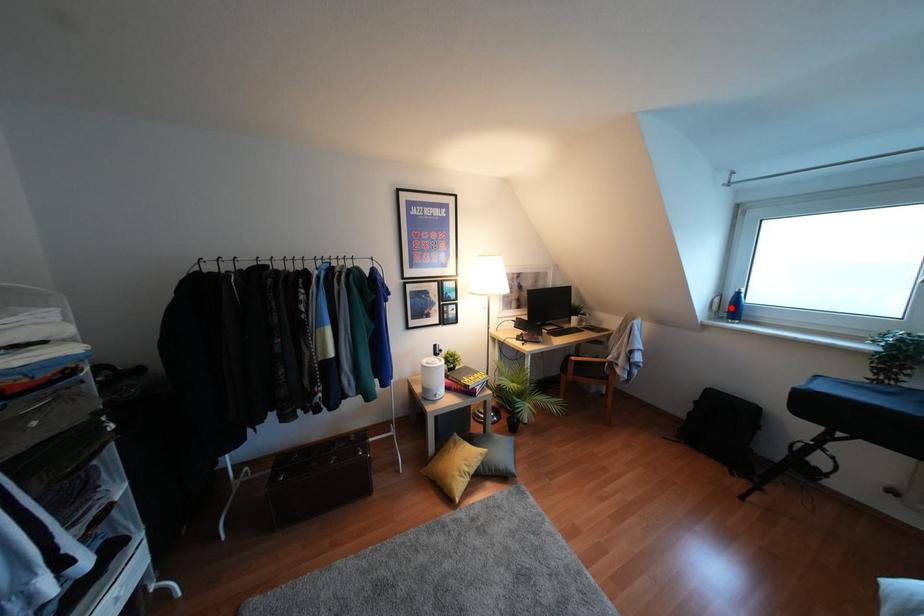
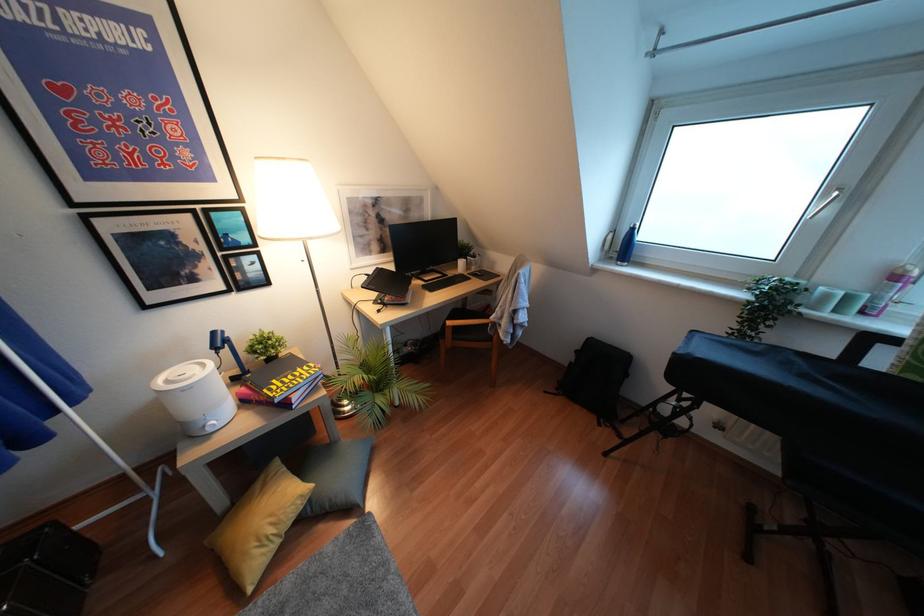
Locate, in the second image, the point that corresponds to the highlighted location in the first image.

(623, 246)